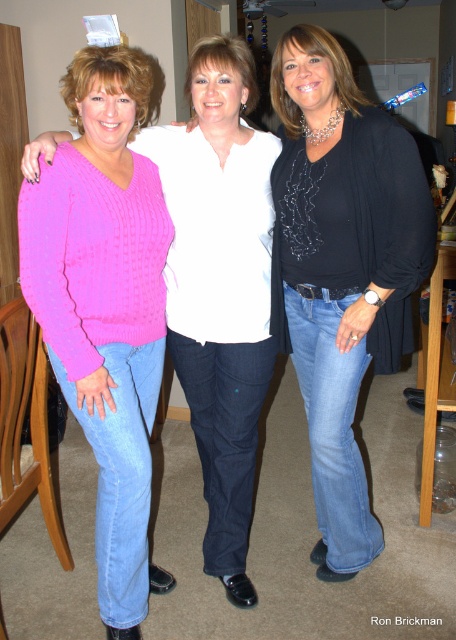
You are standing in the room and see two points marked in the image. The first point is at position point [327,177] and the second point is at point [139,278]. Which point is closer to you?

Point [139,278] is closer to you because it is in front of point [327,177].

You are organizing a clothing rack and need to arrange the black matte shirt at center and the pink knitted sweater at left based on their positions in the image. Which clothing item should be placed to the right side of the rack?

The black matte shirt at center should be placed to the right side of the rack because it is positioned to the right of the pink knitted sweater at left in the image.